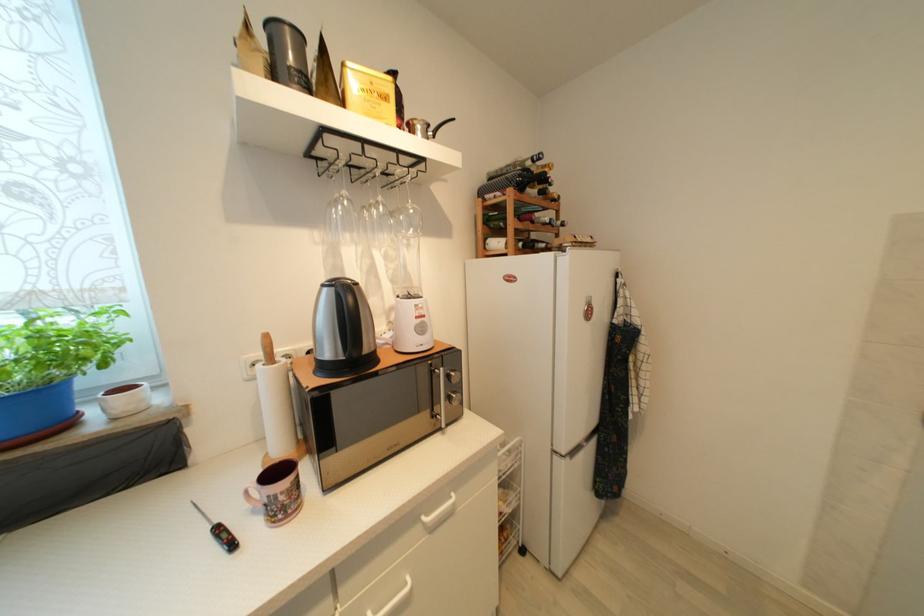
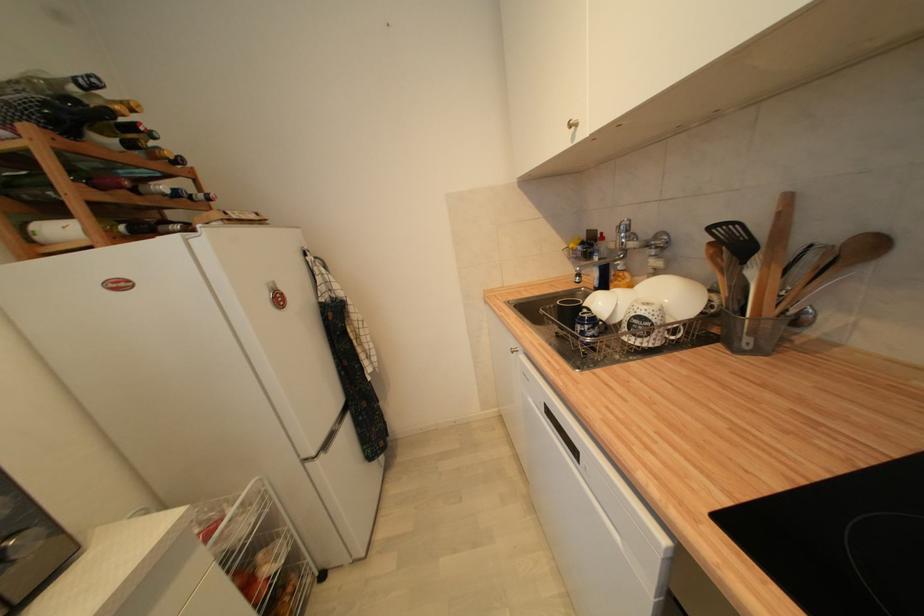
Locate, in the second image, the point that corresponds to (543,185) in the first image.

(128, 132)